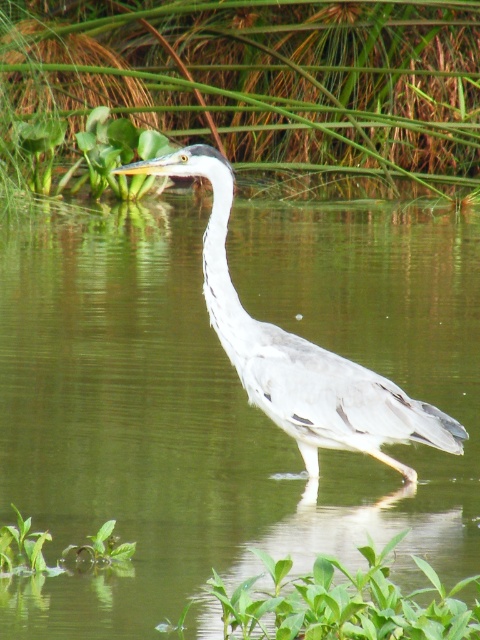
You are a photographer trying to capture the gray matte heron at center. You notice the green smooth water at center is reflecting the heron. To avoid the reflection, which object should you position yourself closer to?

To avoid the reflection of the gray matte heron at center, you should position yourself closer to the green smooth water at center since it is in front of the heron, allowing you to angle the shot to minimize the reflection.

You are a photographer trying to capture the gray matte heron at center. You notice the green smooth water at center in the background. Which object is positioned to the left of the other?

The green smooth water at center is to the left of gray matte heron at center according to the description.